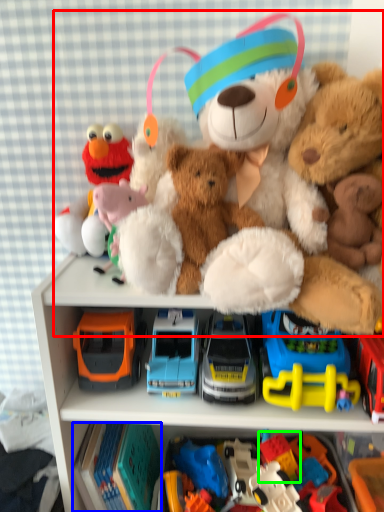
Question: Which object is the farthest from teddy bear (highlighted by a red box)? Choose among these: toy (highlighted by a blue box) or toy (highlighted by a green box).

Choices:
 (A) toy
 (B) toy

Answer: (B)